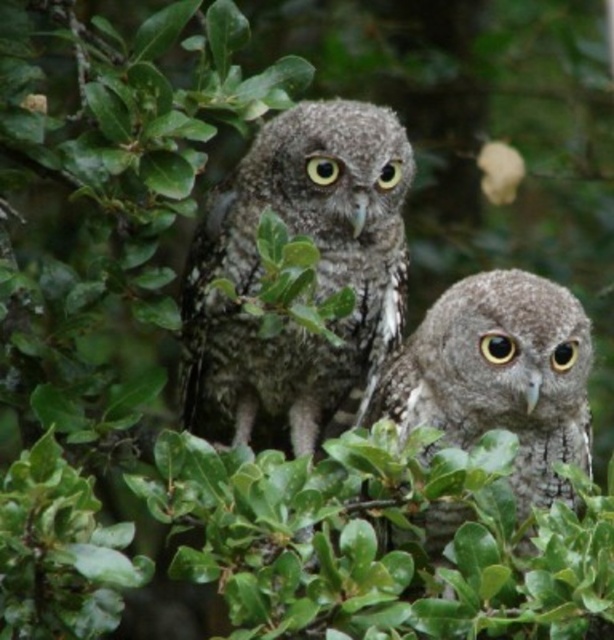
Is speckled feather owl at center bigger than speckled gray owl at center?

Indeed, speckled feather owl at center has a larger size compared to speckled gray owl at center.

Does speckled feather owl at center have a lesser width compared to speckled gray owl at center?

No, speckled feather owl at center is not thinner than speckled gray owl at center.

This screenshot has width=614, height=640. I want to click on speckled feather owl at center, so click(316, 276).